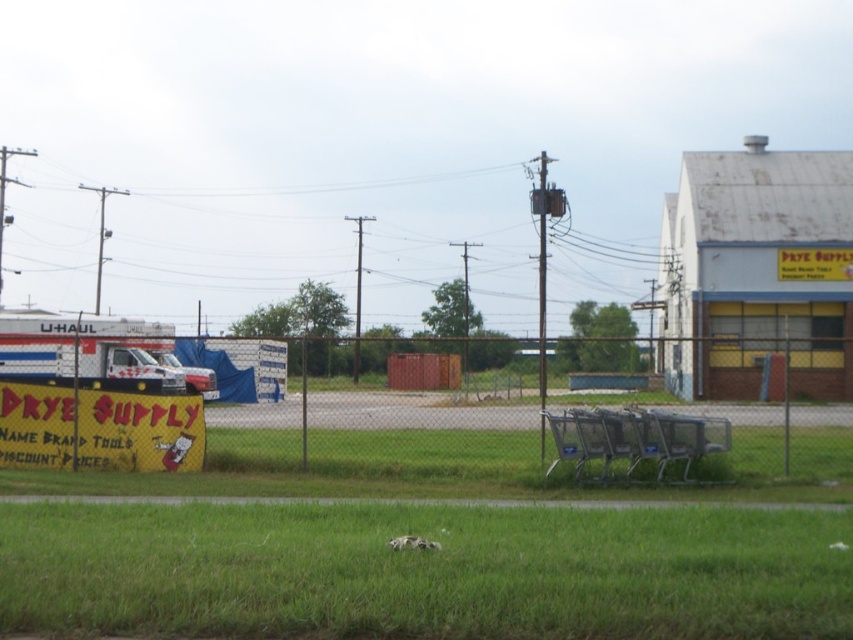
Between green grass at lower center and yellow paper sign at left, which one is positioned lower?

Positioned lower is green grass at lower center.

Is green grass at lower center further to the viewer compared to yellow paper sign at left?

No, green grass at lower center is closer to the viewer.

Between point (601, 625) and point (97, 397), which one is positioned behind?

The point (97, 397) is behind.

This screenshot has height=640, width=853. I want to click on green grass at lower center, so click(x=425, y=572).

Can you confirm if metallic chain-link fence at center is thinner than yellow paper sign at left?

Incorrect, metallic chain-link fence at center's width is not less than yellow paper sign at left's.

Is metallic chain-link fence at center taller than yellow paper sign at left?

Yes, metallic chain-link fence at center is taller than yellow paper sign at left.

Does point (642, 442) come in front of point (85, 445)?

Yes, it is.

Find the location of `metallic chain-link fence at center`. metallic chain-link fence at center is located at coordinates (526, 433).

Does green grass at lower center have a greater width compared to metallic chain-link fence at center?

In fact, green grass at lower center might be narrower than metallic chain-link fence at center.

Is green grass at lower center smaller than metallic chain-link fence at center?

Yes.

Where is `green grass at lower center`? Image resolution: width=853 pixels, height=640 pixels. green grass at lower center is located at coordinates (425, 572).

Where is `green grass at lower center`? green grass at lower center is located at coordinates point(425,572).